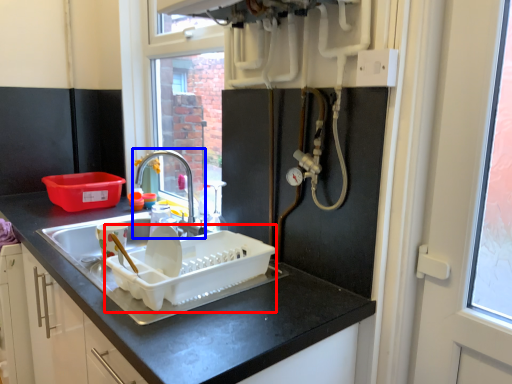
Question: Which point is further to the camera, appliance (highlighted by a red box) or tap (highlighted by a blue box)?

Choices:
 (A) appliance
 (B) tap

Answer: (B)